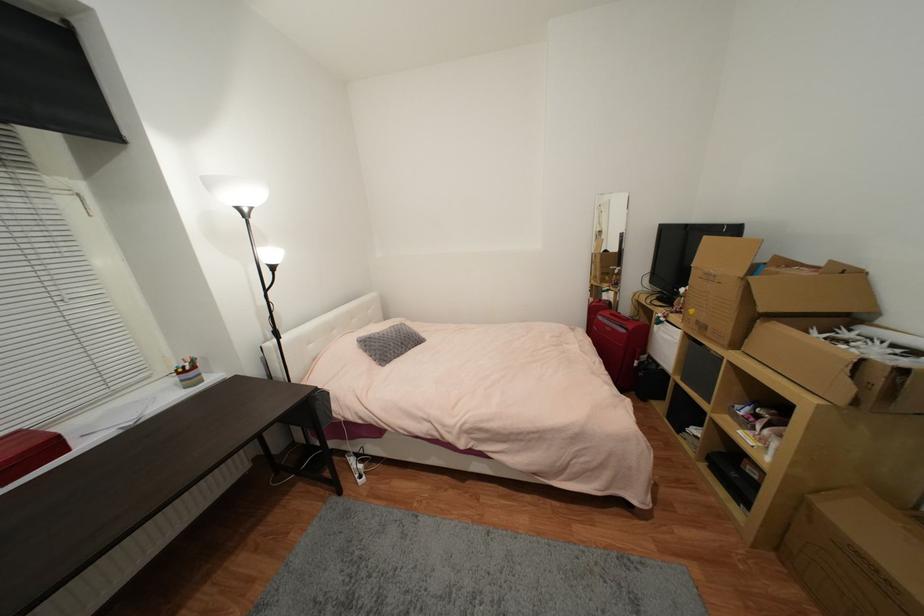
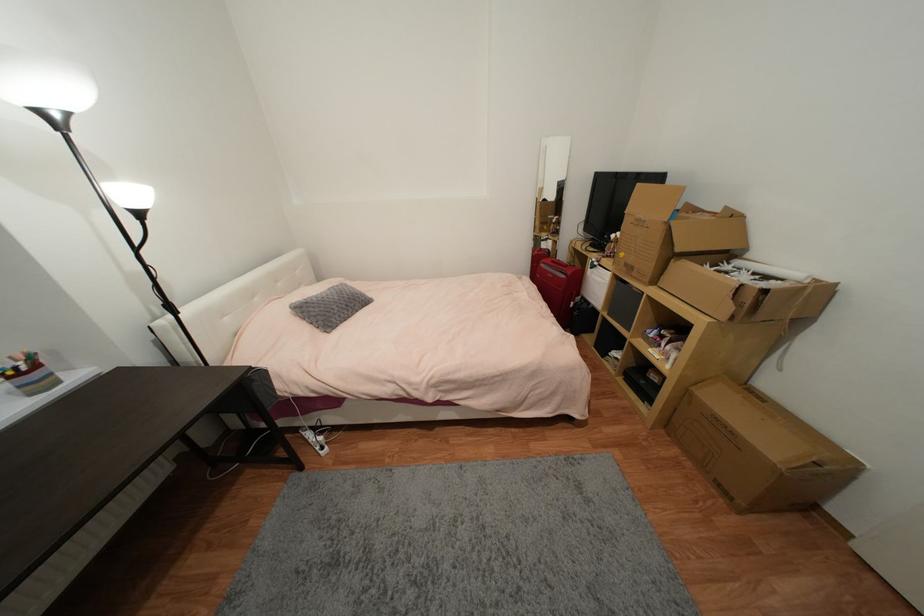
Question: Based on the continuous images, in which direction is the camera rotating? Reply with the corresponding letter.

Choices:
 (A) Left
 (B) Right
 (C) Up
 (D) Down

Answer: (B)